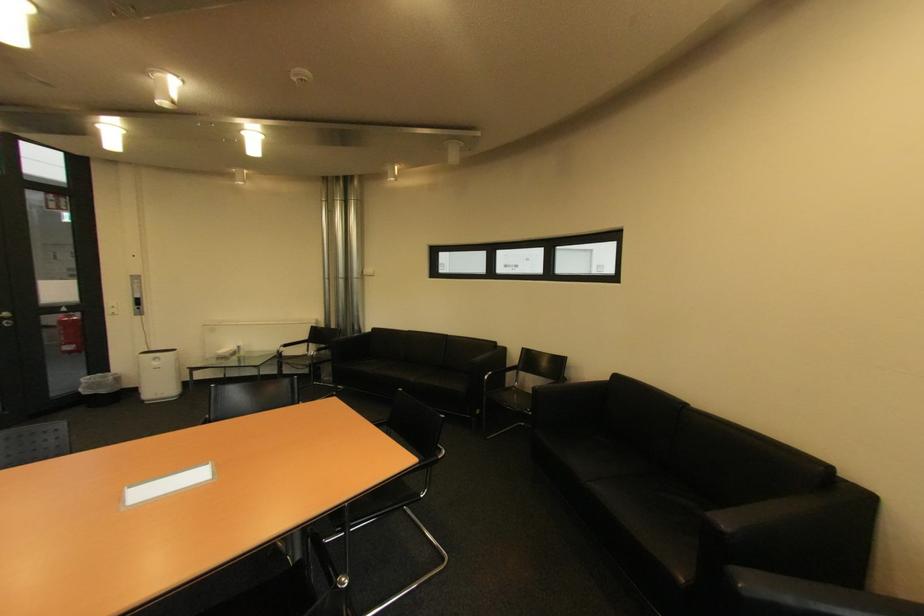
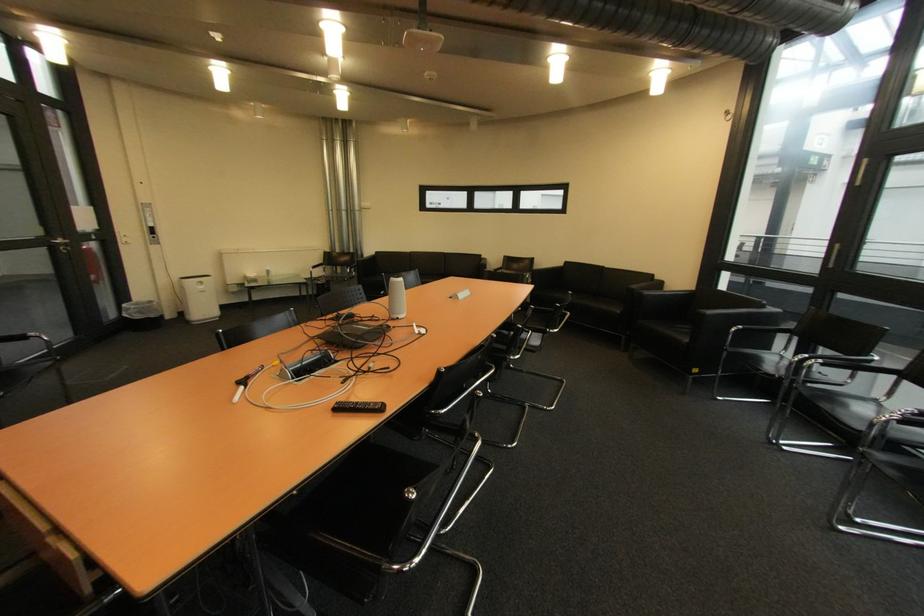
What movement of the cameraman would produce the second image?

The cameraman walked toward left, backward.